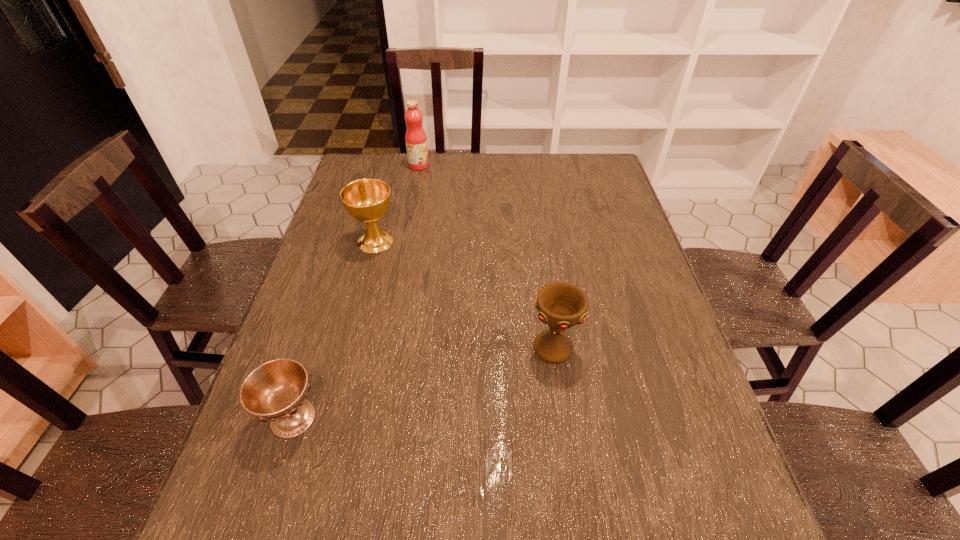
At what (x,y) coordinates should I click in order to perform the action: click on vacant space that satisfies the following two spatial constraints: 1. on the front label of the tallest object; 2. on the back side of the rightmost object. Please return your answer as a coordinate pair (x, y). Looking at the image, I should click on (385, 349).

The height and width of the screenshot is (540, 960). In order to click on free spot that satisfies the following two spatial constraints: 1. on the front label of the tallest object; 2. on the front side of the shortest object in this screenshot , I will do `click(372, 418)`.